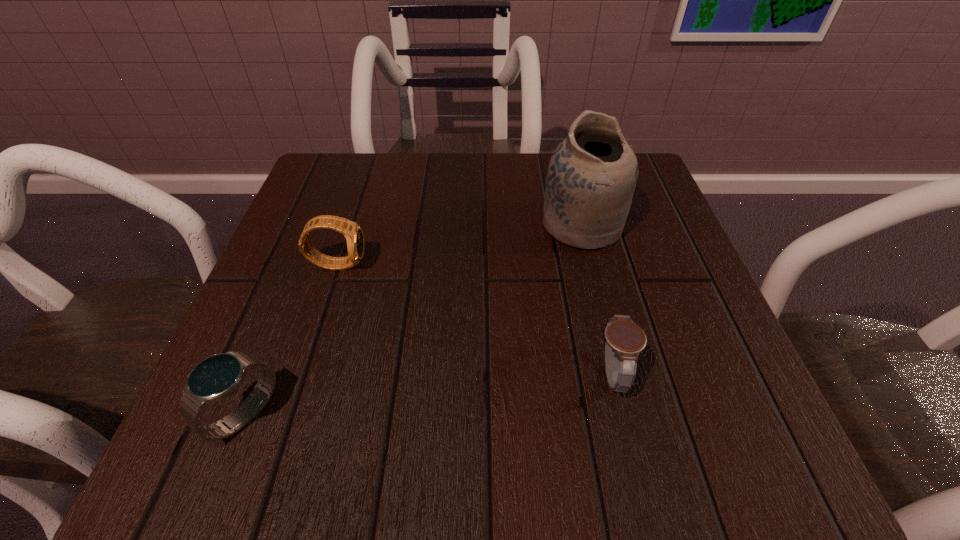
Identify the location of free space that is in between the farthest watch and the pottery. This screenshot has height=540, width=960. (460, 244).

Where is `object that can be found as the closest to the rightmost watch`? object that can be found as the closest to the rightmost watch is located at coordinates (592, 174).

This screenshot has height=540, width=960. Identify the location of object that can be found as the third closest to the rightmost watch. (217, 377).

Select which watch appears as the closest to the tallest object. Please provide its 2D coordinates. Your answer should be formatted as a tuple, i.e. [(x, y)], where the tuple contains the x and y coordinates of a point satisfying the conditions above.

[(624, 340)]

At what (x,y) coordinates should I click in order to perform the action: click on watch that is the second closest to the farthest watch. Please return your answer as a coordinate pair (x, y). Looking at the image, I should click on (624, 340).

Locate an element on the screen. free space in the image that satisfies the following two spatial constraints: 1. on the face of the farthest watch; 2. on the back side of the rightmost watch is located at coordinates (302, 374).

Where is `blank area in the image that satisfies the following two spatial constraints: 1. on the face of the rightmost watch; 2. on the left side of the farthest watch`? This screenshot has width=960, height=540. blank area in the image that satisfies the following two spatial constraints: 1. on the face of the rightmost watch; 2. on the left side of the farthest watch is located at coordinates (302, 374).

You are a GUI agent. You are given a task and a screenshot of the screen. Output one action in this format:
    pyautogui.click(x=<x>, y=<y>)
    Task: Click on the vacant area in the image that satisfies the following two spatial constraints: 1. on the front side of the pottery; 2. on the face of the farthest watch
    
    Given the screenshot: What is the action you would take?
    pyautogui.click(x=591, y=264)

You are a GUI agent. You are given a task and a screenshot of the screen. Output one action in this format:
    pyautogui.click(x=<x>, y=<y>)
    Task: Click on the free space in the image that satisfies the following two spatial constraints: 1. on the front side of the tallest object; 2. on the face of the farthest watch
    The height and width of the screenshot is (540, 960).
    Given the screenshot: What is the action you would take?
    pyautogui.click(x=591, y=264)